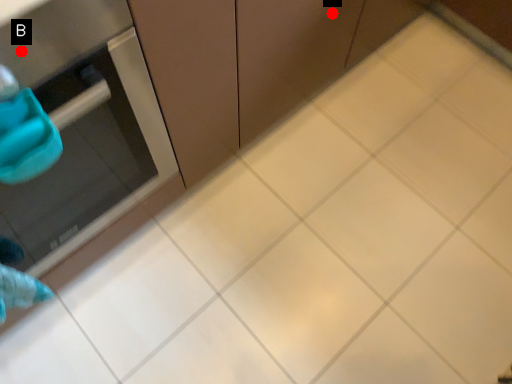
Question: Two points are circled on the image, labeled by A and B beside each circle. Which of the following is the closest to the observer?

Choices:
 (A) A is closer
 (B) B is closer

Answer: (B)